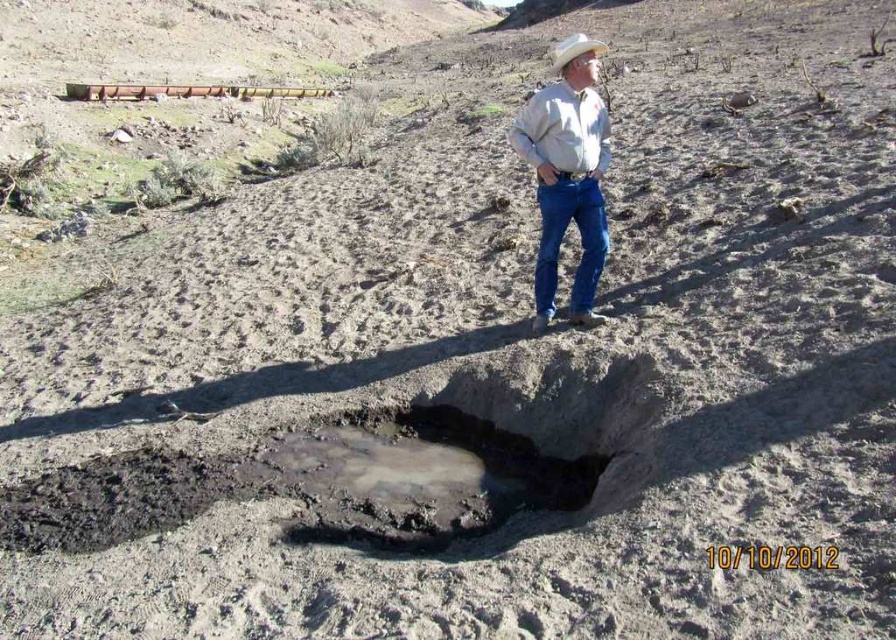
Is point (586, 97) more distant than point (587, 44)?

Yes, point (586, 97) is farther from viewer.

Which is above, gray cotton shirt at upper right or white matte cowboy hat at upper center?

white matte cowboy hat at upper center is above.

Is point (556, 269) farther from viewer compared to point (592, 45)?

Yes, point (556, 269) is behind point (592, 45).

Locate an element on the screen. The height and width of the screenshot is (640, 896). gray cotton shirt at upper right is located at coordinates (567, 173).

Between muddy stone hole at center and white matte cowboy hat at upper center, which one is positioned lower?

muddy stone hole at center is lower down.

This screenshot has height=640, width=896. I want to click on muddy stone hole at center, so click(470, 452).

Does muddy stone hole at center have a lesser width compared to gray cotton shirt at upper right?

No, muddy stone hole at center is not thinner than gray cotton shirt at upper right.

Between point (517, 456) and point (586, 88), which one is positioned in front?

Positioned in front is point (517, 456).

Where is `muddy stone hole at center`? Image resolution: width=896 pixels, height=640 pixels. muddy stone hole at center is located at coordinates pos(470,452).